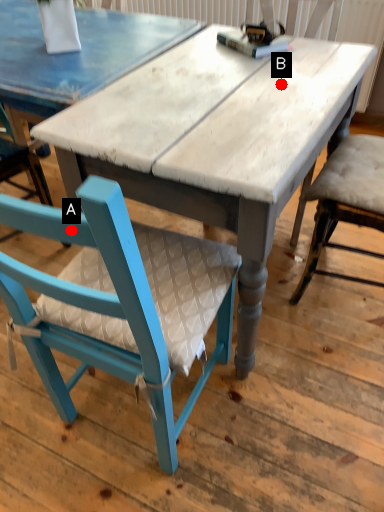
Question: Two points are circled on the image, labeled by A and B beside each circle. Which point is closer to the camera?

Choices:
 (A) A is closer
 (B) B is closer

Answer: (A)